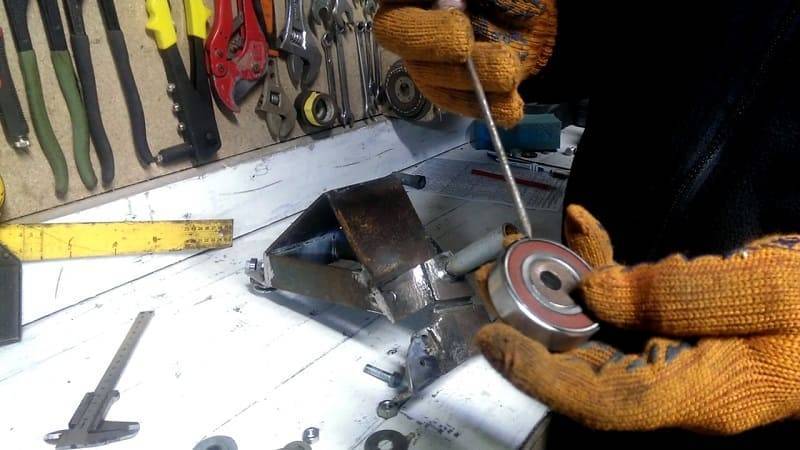
The image size is (800, 450). What are the coordinates of `washers` in the screenshot? It's located at (386, 440), (290, 444), (224, 439).